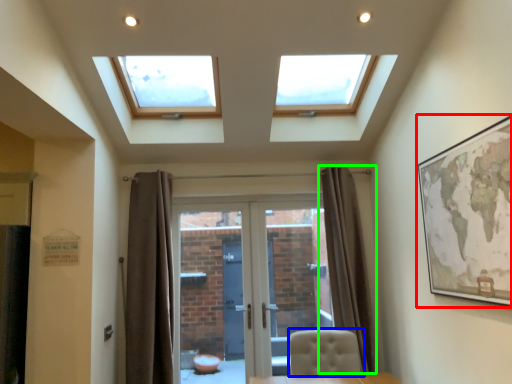
Question: Which is farther away from picture frame (highlighted by a red box)? chair (highlighted by a blue box) or curtain (highlighted by a green box)?

Choices:
 (A) chair
 (B) curtain

Answer: (B)